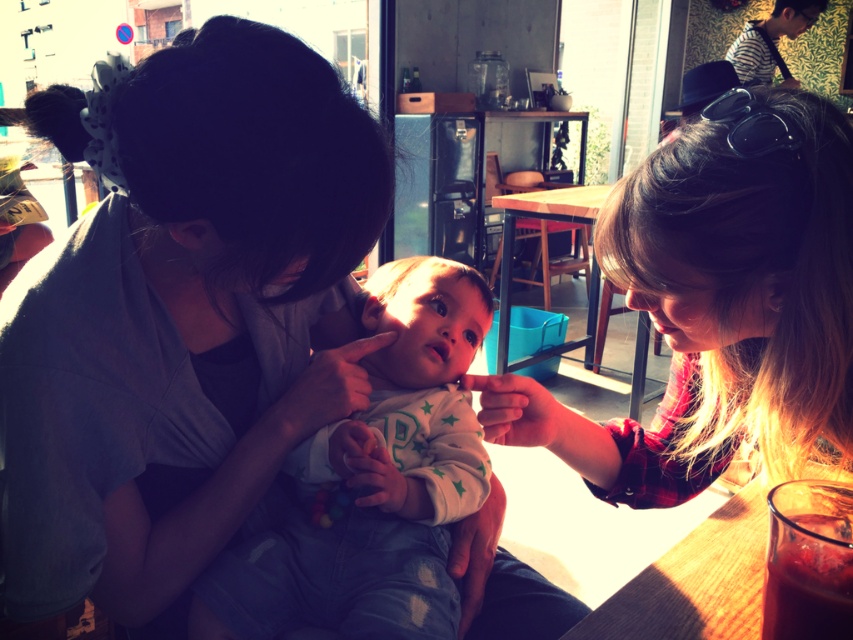
Question: Does matte gray shirt at center appear under translucent glass juice at lower right?

Choices:
 (A) yes
 (B) no

Answer: (B)

Question: Is plaid shirt at right behind white soft fabric baby at center?

Choices:
 (A) no
 (B) yes

Answer: (A)

Question: Estimate the real-world distances between objects in this image. Which object is closer to the wooden table at lower right?

Choices:
 (A) matte gray shirt at center
 (B) plaid shirt at right

Answer: (B)

Question: Is white soft fabric baby at center smaller than wooden table at lower right?

Choices:
 (A) yes
 (B) no

Answer: (B)

Question: Estimate the real-world distances between objects in this image. Which object is farther from the translucent glass juice at lower right?

Choices:
 (A) matte gray shirt at center
 (B) plaid shirt at right

Answer: (A)

Question: Which of the following is the closest to the observer?

Choices:
 (A) translucent glass juice at lower right
 (B) plaid shirt at right
 (C) matte gray shirt at center

Answer: (A)